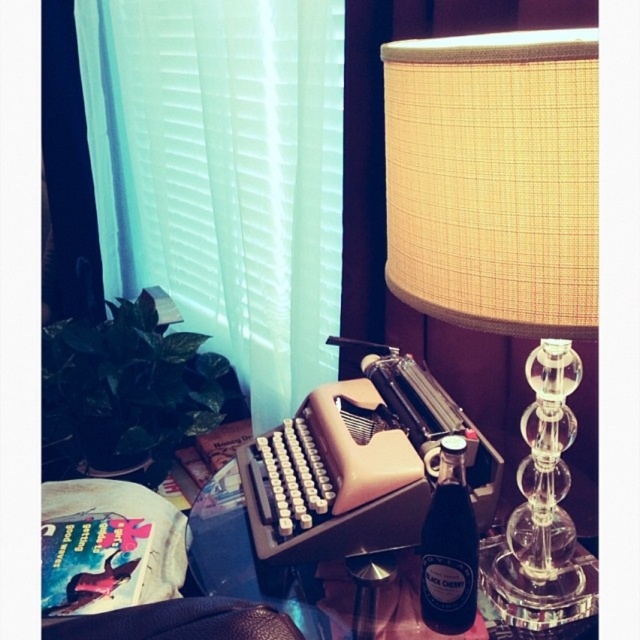
Question: Which point is farther to the camera?

Choices:
 (A) (388, 616)
 (B) (128, 620)
 (C) (256, 42)
 (D) (483, 40)

Answer: (C)

Question: Can you confirm if black glass bottle at right is positioned to the right of leather at lower left?

Choices:
 (A) yes
 (B) no

Answer: (A)

Question: Among these objects, which one is farthest from the camera?

Choices:
 (A) translucent glass table at center
 (B) mint green sheer curtain at left

Answer: (B)

Question: Does mint green sheer curtain at left appear on the right side of black glass bottle at right?

Choices:
 (A) no
 (B) yes

Answer: (A)

Question: Is beige fabric lampshade at upper right further to the viewer compared to translucent glass table at center?

Choices:
 (A) no
 (B) yes

Answer: (A)

Question: Which object appears farthest from the camera in this image?

Choices:
 (A) leather at lower left
 (B) beige fabric lampshade at upper right
 (C) translucent glass table at center

Answer: (C)